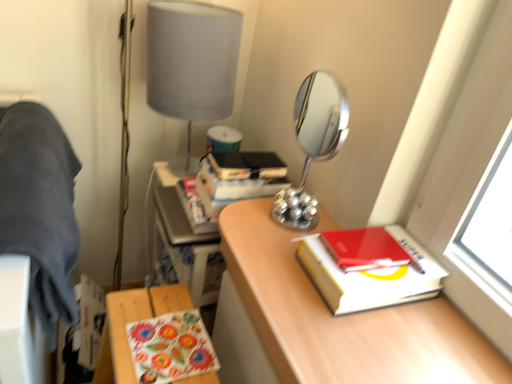
Question: Based on their positions, is chrome/metallic mirror at center located to the left or right of red matte notebook at right?

Choices:
 (A) left
 (B) right

Answer: (A)

Question: Is chrome/metallic mirror at center wider or thinner than red matte notebook at right?

Choices:
 (A) thin
 (B) wide

Answer: (A)

Question: Which is farther from the chrome/metallic mirror at center?

Choices:
 (A) hardcover book at right
 (B) red matte notebook at right
 (C) dark blue fabric at left
 (D) matte gray lampshade at upper center
 (E) floral fabric table at lower left

Answer: (C)

Question: Estimate the real-world distances between objects in this image. Which object is closer to the floral fabric table at lower left?

Choices:
 (A) chrome/metallic mirror at center
 (B) dark blue fabric at left
 (C) wooden desk at center
 (D) red matte notebook at right
 (E) hardcover book at right

Answer: (C)